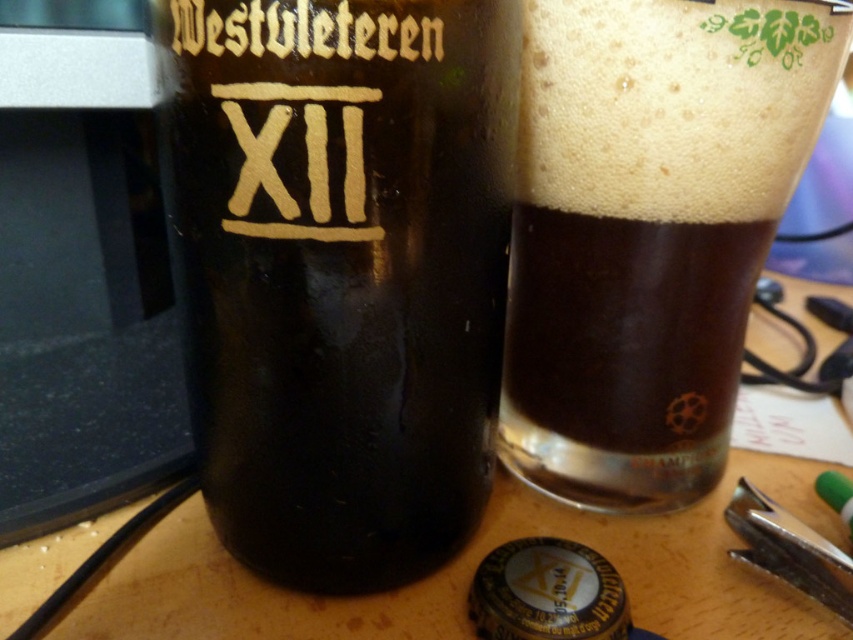
Does matte glass bottle at center have a smaller size compared to dark brown glass at upper center?

Yes, matte glass bottle at center is smaller than dark brown glass at upper center.

Between matte glass bottle at center and dark brown glass at upper center, which one is positioned higher?

dark brown glass at upper center is above.

The image size is (853, 640). Describe the element at coordinates (340, 272) in the screenshot. I see `matte glass bottle at center` at that location.

Locate an element on the screen. This screenshot has width=853, height=640. matte glass bottle at center is located at coordinates (340, 272).